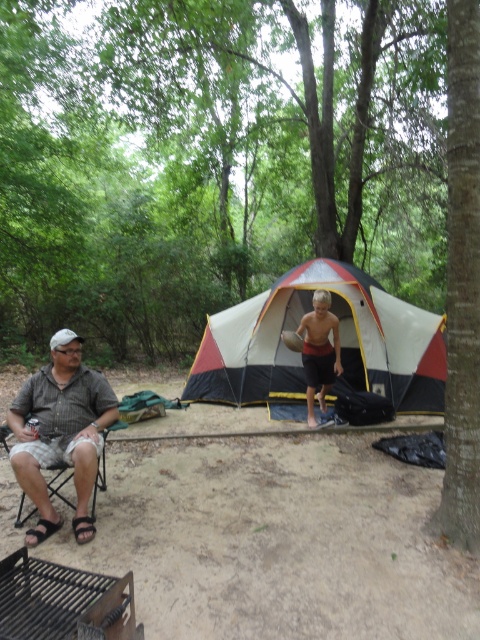
Question: Which point appears closest to the camera in this image?

Choices:
 (A) (393, 353)
 (B) (69, 504)

Answer: (B)

Question: Which object appears farthest from the camera in this image?

Choices:
 (A) shiny brown shorts at center
 (B) matte gray folding chair at left

Answer: (A)

Question: Is white canvas tent at center positioned behind matte gray folding chair at left?

Choices:
 (A) yes
 (B) no

Answer: (A)

Question: Is white canvas tent at center positioned in front of shiny brown shorts at center?

Choices:
 (A) no
 (B) yes

Answer: (A)

Question: Is shiny brown shorts at center bigger than matte gray folding chair at left?

Choices:
 (A) no
 (B) yes

Answer: (B)

Question: Estimate the real-world distances between objects in this image. Which object is closer to the matte gray folding chair at left?

Choices:
 (A) gray striped shirt at left
 (B) shiny brown shorts at center
 (C) white canvas tent at center

Answer: (A)